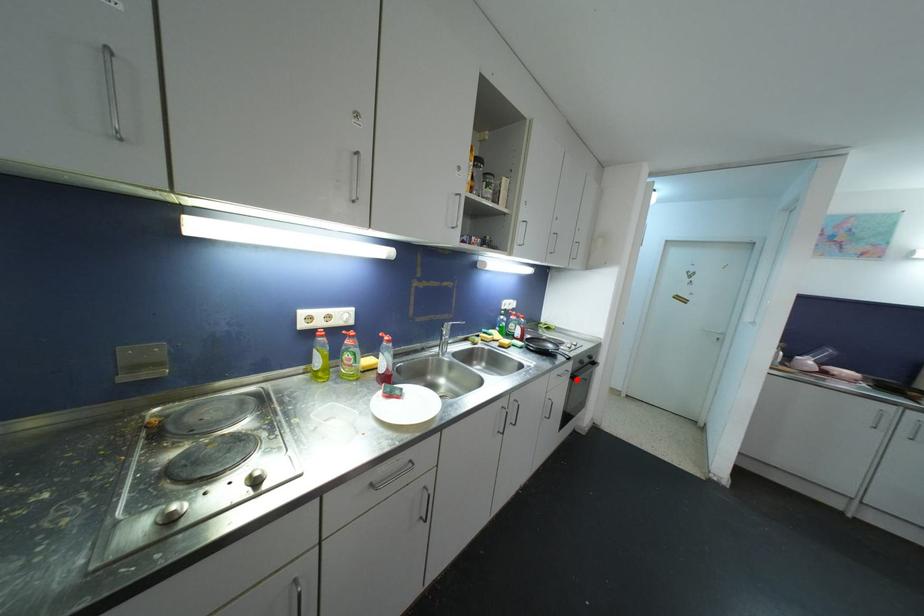
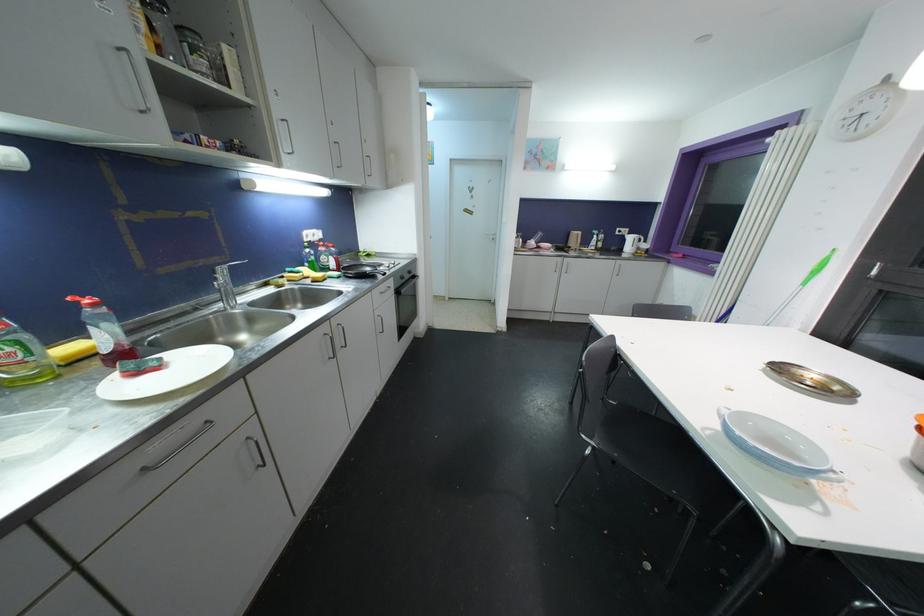
Find the pixel in the second image that matches the highlighted location in the first image.

(400, 294)